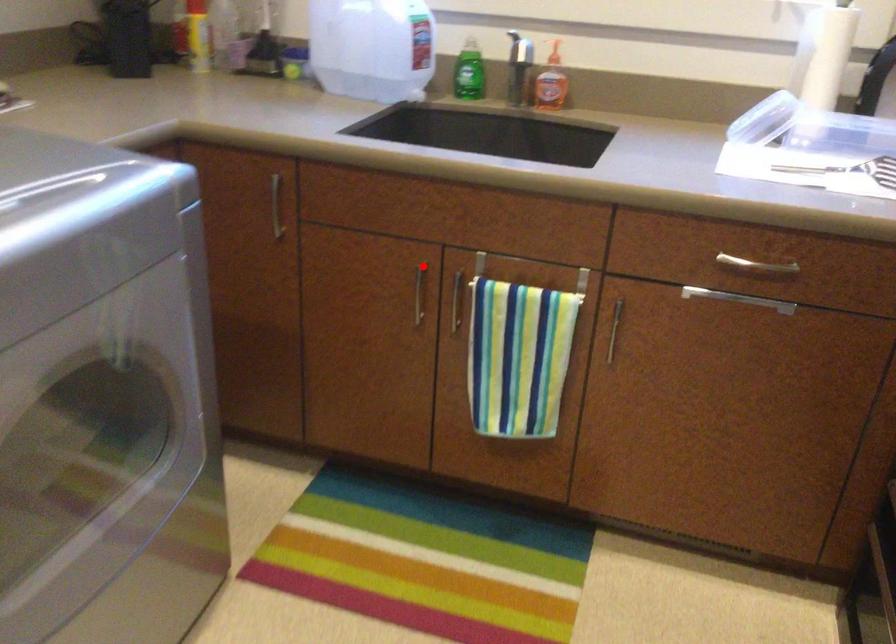
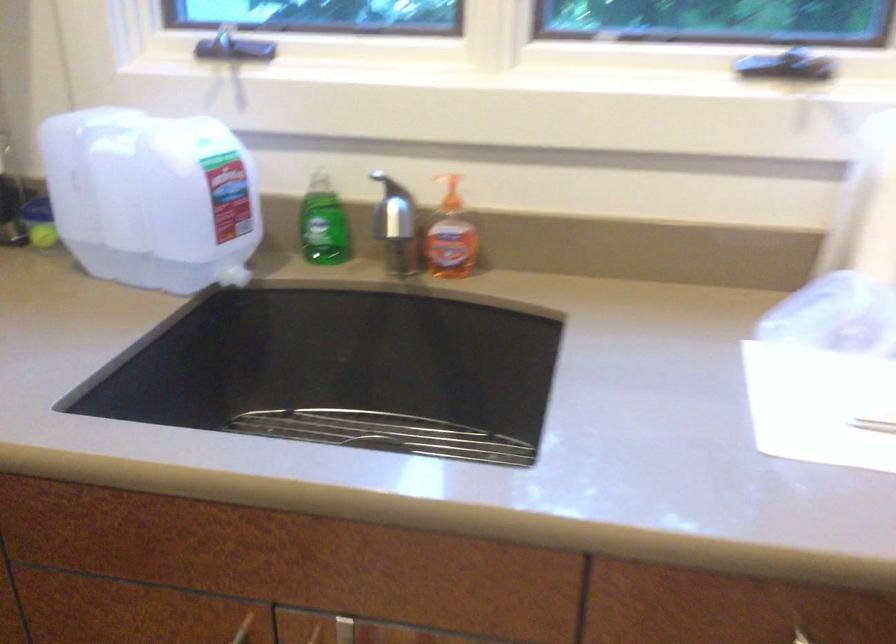
Question: I am providing you with two images of the same scene from different viewpoints. In image1, a red point is highlighted. Considering the same 3D point in image2, which of the following is correct?

Choices:
 (A) It is closer
 (B) It is farther

Answer: (A)